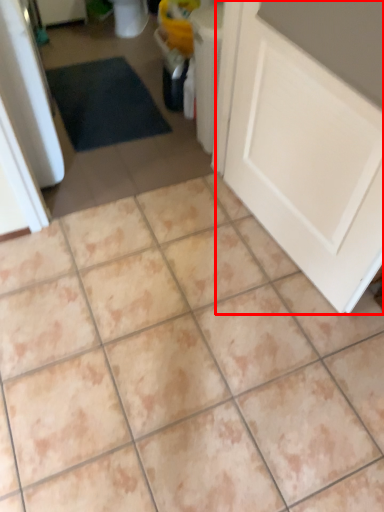
Question: Observing the image, what is the correct spatial positioning of door (annotated by the red box) in reference to ceramic tile?

Choices:
 (A) right
 (B) left

Answer: (A)